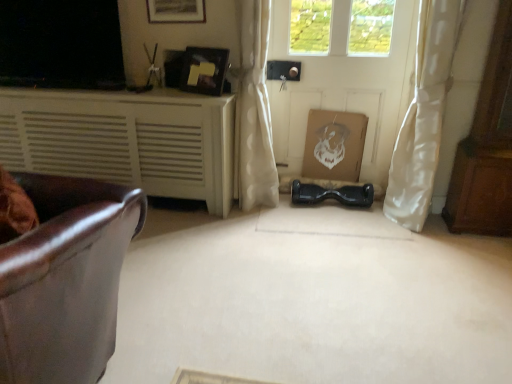
What do you see at coordinates (204, 70) in the screenshot?
I see `matte black picture frame at upper center, acting as the second picture frame starting from the top` at bounding box center [204, 70].

The width and height of the screenshot is (512, 384). What do you see at coordinates (312, 304) in the screenshot? I see `matte black hoverboard at center` at bounding box center [312, 304].

The image size is (512, 384). Identify the location of white sheer curtain at center, placed as the second curtain when sorted from right to left. (254, 111).

In order to face white matte door at center, should I rotate leftwards or rightwards?

Rotate right and turn 10.373 degrees.

This screenshot has width=512, height=384. Identify the location of matte black picture frame at upper center, the 1th picture frame ordered from the bottom. (204, 70).

Which object is positioned more to the right, white sheer curtain at center, placed as the second curtain when sorted from right to left, or brown wooden dresser at right?

Positioned to the right is brown wooden dresser at right.

Considering the relative sizes of white sheer curtain at center, which is the 1th curtain in left-to-right order, and brown wooden dresser at right in the image provided, is white sheer curtain at center, which is the 1th curtain in left-to-right order, bigger than brown wooden dresser at right?

No, white sheer curtain at center, which is the 1th curtain in left-to-right order, is not bigger than brown wooden dresser at right.

Consider the image. Considering the positions of objects white sheer curtain at center, placed as the second curtain when sorted from right to left, and brown wooden dresser at right in the image provided, who is in front, white sheer curtain at center, placed as the second curtain when sorted from right to left, or brown wooden dresser at right?

brown wooden dresser at right is more forward.

From the image's perspective, which object appears higher, white cardboard box at center or matte black hoverboard at center?

white cardboard box at center appears higher in the image.

Considering the relative positions of white cardboard box at center and matte black hoverboard at center in the image provided, is white cardboard box at center to the left or to the right of matte black hoverboard at center?

Based on their positions, white cardboard box at center is located to the right of matte black hoverboard at center.

Which of these two, white cardboard box at center or matte black hoverboard at center, is smaller?

white cardboard box at center.

Can you tell me how much white cardboard box at center and matte black hoverboard at center differ in facing direction?

84.9 degrees.

At what (x,y) coordinates should I click in order to perform the action: click on cardboard box behind the wooden picture frame at upper center, marked as the 1th picture frame in a top-to-bottom arrangement. Please return your answer as a coordinate pair (x, y). Looking at the image, I should click on (334, 145).

From the picture: Is wooden picture frame at upper center, which is counted as the second picture frame, starting from the bottom, looking in the opposite direction of white cardboard box at center?

No.

From the image's perspective, is wooden picture frame at upper center, which is counted as the second picture frame, starting from the bottom, above or below white cardboard box at center?

wooden picture frame at upper center, which is counted as the second picture frame, starting from the bottom, is above white cardboard box at center.

Considering the relative positions of wooden picture frame at upper center, which is counted as the second picture frame, starting from the bottom, and white cardboard box at center in the image provided, is wooden picture frame at upper center, which is counted as the second picture frame, starting from the bottom, behind white cardboard box at center?

No, wooden picture frame at upper center, which is counted as the second picture frame, starting from the bottom, is closer to the camera.

From a real-world perspective, between matte black picture frame at upper center, the 1th picture frame ordered from the bottom, and white matte cabinet at left, who is vertically higher?

matte black picture frame at upper center, the 1th picture frame ordered from the bottom.

From the image's perspective, between matte black picture frame at upper center, the 1th picture frame ordered from the bottom, and white matte cabinet at left, which one is located above?

matte black picture frame at upper center, the 1th picture frame ordered from the bottom, is shown above in the image.

Which is in front, matte black picture frame at upper center, the 1th picture frame ordered from the bottom, or white matte cabinet at left?

Positioned in front is white matte cabinet at left.

Can you confirm if matte black picture frame at upper center, acting as the second picture frame starting from the top, is shorter than white matte cabinet at left?

Indeed, matte black picture frame at upper center, acting as the second picture frame starting from the top, has a lesser height compared to white matte cabinet at left.

Does white matte door at center come behind white cardboard box at center?

No, white matte door at center is in front of white cardboard box at center.

Is there a large distance between white matte door at center and white cardboard box at center?

No.

Is white matte door at center inside or outside of white cardboard box at center?

white matte door at center cannot be found inside white cardboard box at center.

From a real-world perspective, who is located lower, white matte door at center or white cardboard box at center?

From a 3D spatial view, white cardboard box at center is below.

Considering the relative positions of white sheer curtain at right, the 1th curtain viewed from the right, and white matte cabinet at left in the image provided, is white sheer curtain at right, the 1th curtain viewed from the right, to the left or to the right of white matte cabinet at left?

From the image, it's evident that white sheer curtain at right, the 1th curtain viewed from the right, is to the right of white matte cabinet at left.

How different are the orientations of white sheer curtain at right, which is the 2th curtain from left to right, and white matte cabinet at left in degrees?

1.33 degrees separate the facing orientations of white sheer curtain at right, which is the 2th curtain from left to right, and white matte cabinet at left.

Is white sheer curtain at right, the 1th curtain viewed from the right, behind white matte cabinet at left?

No, it is in front of white matte cabinet at left.

Is white sheer curtain at right, which is the 2th curtain from left to right, next to white matte cabinet at left?

No, white sheer curtain at right, which is the 2th curtain from left to right, is not in contact with white matte cabinet at left.

From a real-world perspective, is matte black hoverboard at center under white cardboard box at center?

Yes, from a real-world perspective, matte black hoverboard at center is under white cardboard box at center.

Does matte black hoverboard at center have a lesser height compared to white cardboard box at center?

Indeed, matte black hoverboard at center has a lesser height compared to white cardboard box at center.

Considering the sizes of objects matte black hoverboard at center and white cardboard box at center in the image provided, who is bigger, matte black hoverboard at center or white cardboard box at center?

With larger size is matte black hoverboard at center.

Between point (279, 358) and point (332, 160), which one is positioned behind?

The point (332, 160) is farther.

Find the location of `dresser that is on the right side of white sheer curtain at center, which is the 1th curtain in left-to-right order`. dresser that is on the right side of white sheer curtain at center, which is the 1th curtain in left-to-right order is located at coordinates (487, 146).

The height and width of the screenshot is (384, 512). Find the location of `cardboard box above the matte black hoverboard at center (from a real-world perspective)`. cardboard box above the matte black hoverboard at center (from a real-world perspective) is located at coordinates coord(334,145).

Which object lies further to the anchor point white matte door at center, white sheer curtain at center, placed as the second curtain when sorted from right to left, or matte black picture frame at upper center, the 1th picture frame ordered from the bottom?

matte black picture frame at upper center, the 1th picture frame ordered from the bottom, is positioned further to the anchor white matte door at center.

From the image, which object appears to be nearer to matte black hoverboard at center, white cardboard box at center or white matte cabinet at left?

Among the two, white matte cabinet at left is located nearer to matte black hoverboard at center.

When comparing their distances from white matte cabinet at left, does white matte door at center or wooden picture frame at upper center, marked as the 1th picture frame in a top-to-bottom arrangement, seem closer?

wooden picture frame at upper center, marked as the 1th picture frame in a top-to-bottom arrangement, lies closer to white matte cabinet at left than the other object.

Which object lies nearer to the anchor point wooden picture frame at upper center, which is counted as the second picture frame, starting from the bottom, white matte cabinet at left or brown wooden dresser at right?

The object closer to wooden picture frame at upper center, which is counted as the second picture frame, starting from the bottom, is white matte cabinet at left.

Considering their positions, is white sheer curtain at right, the 1th curtain viewed from the right, positioned closer to brown wooden dresser at right than matte black picture frame at upper center, acting as the second picture frame starting from the top?

Among the two, white sheer curtain at right, the 1th curtain viewed from the right, is located nearer to brown wooden dresser at right.

Considering their positions, is wooden picture frame at upper center, which is counted as the second picture frame, starting from the bottom, positioned further to white matte door at center than white cardboard box at center?

Among the two, wooden picture frame at upper center, which is counted as the second picture frame, starting from the bottom, is located further to white matte door at center.

Looking at the image, which one is located closer to white sheer curtain at center, placed as the second curtain when sorted from right to left, white matte cabinet at left or matte black picture frame at upper center, acting as the second picture frame starting from the top?

matte black picture frame at upper center, acting as the second picture frame starting from the top.

Which object lies further to the anchor point matte black hoverboard at center, white sheer curtain at center, placed as the second curtain when sorted from right to left, or white matte door at center?

white matte door at center.

This screenshot has height=384, width=512. What are the coordinates of `dresser between matte black hoverboard at center and white matte door at center from front to back` in the screenshot? It's located at (487, 146).

This screenshot has width=512, height=384. I want to click on door between white sheer curtain at center, placed as the second curtain when sorted from right to left, and white sheer curtain at right, the 1th curtain viewed from the right, from left to right, so click(344, 87).

You are a GUI agent. You are given a task and a screenshot of the screen. Output one action in this format:
    pyautogui.click(x=<x>, y=<y>)
    Task: Click on the cardboard box between white matte door at center and brown wooden dresser at right
    Image resolution: width=512 pixels, height=384 pixels.
    Given the screenshot: What is the action you would take?
    pyautogui.click(x=334, y=145)

The image size is (512, 384). What are the coordinates of `door situated between wooden picture frame at upper center, marked as the 1th picture frame in a top-to-bottom arrangement, and white sheer curtain at right, which is the 2th curtain from left to right, from left to right` in the screenshot? It's located at (344, 87).